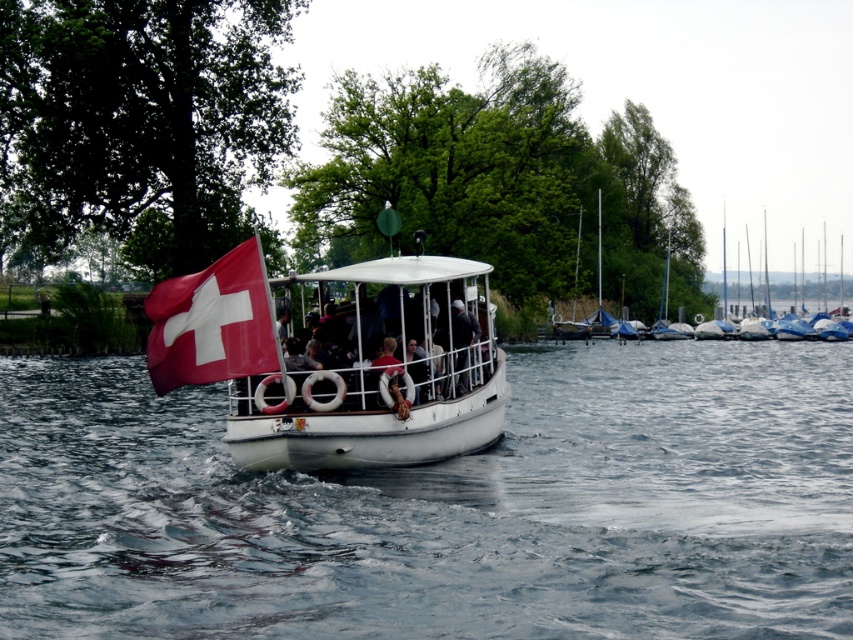
You are planning to dock your small boat at the center. There is a space between the white matte boat at center and the white glossy sailboats at right. Can your boat fit in that space if your boat is 2 meters wide?

The white matte boat at center has a lesser width compared to white glossy sailboats at right. Therefore, the space between them may be narrower than the width of your boat, so it might not fit. Check the exact measurements before deciding.

You are a photographer on the shore and want to capture both the white matte boat at center and the white glossy sailboats at right in a single shot. Which boat should you position closer to the center of your camera frame to ensure both are visible?

The white matte boat at center is positioned on the left side of white glossy sailboats at right. To include both in the frame, position the white glossy sailboats at right closer to the center so that the white matte boat at center remains visible on the left while the sailboats are centered.

Looking at this image, you are a tourist on a boat tour and notice the white matte boat at center and the red matte flag at center. From your position on the boat, which object is closer to you?

The white matte boat at center is closer to you because the red matte flag at center is behind it.